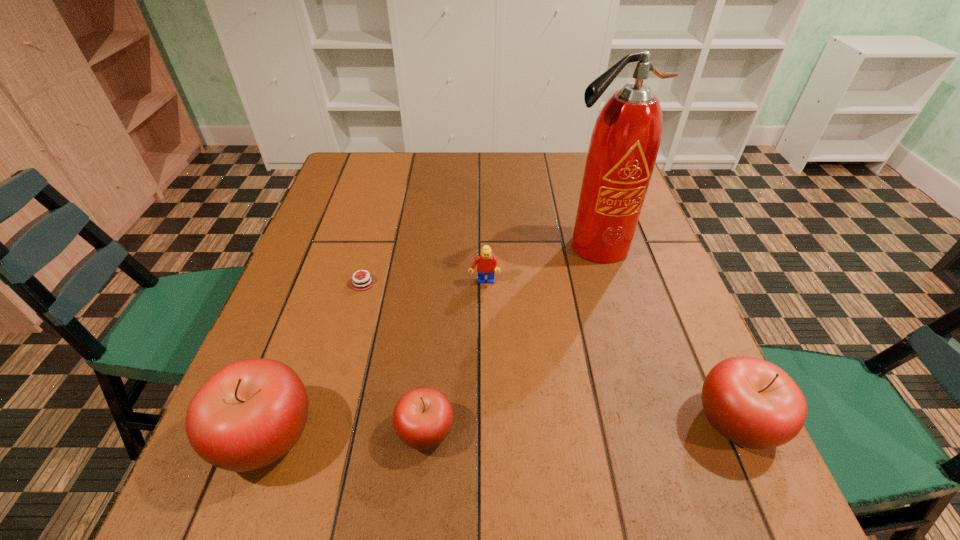
At what (x,y) coordinates should I click in order to perform the action: click on free space between the second shortest apple and the tallest object. Please return your answer as a coordinate pair (x, y). Looking at the image, I should click on (665, 333).

Where is `unoccupied area between the third tallest object and the tallest object`? The width and height of the screenshot is (960, 540). unoccupied area between the third tallest object and the tallest object is located at coordinates (665, 333).

Locate an element on the screen. This screenshot has width=960, height=540. blank region between the leftmost apple and the fire extinguisher is located at coordinates point(431,341).

Locate an element on the screen. free space between the fire extinguisher and the second tallest apple is located at coordinates (665, 333).

I want to click on free space between the shortest apple and the Lego, so click(455, 356).

Select which object appears as the fourth closest to the leftmost apple. Please provide its 2D coordinates. Your answer should be formatted as a tuple, i.e. [(x, y)], where the tuple contains the x and y coordinates of a point satisfying the conditions above.

[(624, 144)]

Identify which object is the second nearest to the fourth object from left to right. Please provide its 2D coordinates. Your answer should be formatted as a tuple, i.e. [(x, y)], where the tuple contains the x and y coordinates of a point satisfying the conditions above.

[(366, 281)]

Locate which apple is the closest to the fire extinguisher. Please provide its 2D coordinates. Your answer should be formatted as a tuple, i.e. [(x, y)], where the tuple contains the x and y coordinates of a point satisfying the conditions above.

[(754, 403)]

The height and width of the screenshot is (540, 960). I want to click on apple that is the closest one to the rightmost apple, so click(x=423, y=417).

Find the location of a particular element. Image resolution: width=960 pixels, height=540 pixels. free location that satisfies the following two spatial constraints: 1. on the front side of the shortest apple; 2. on the right side of the shortest object is located at coordinates (323, 430).